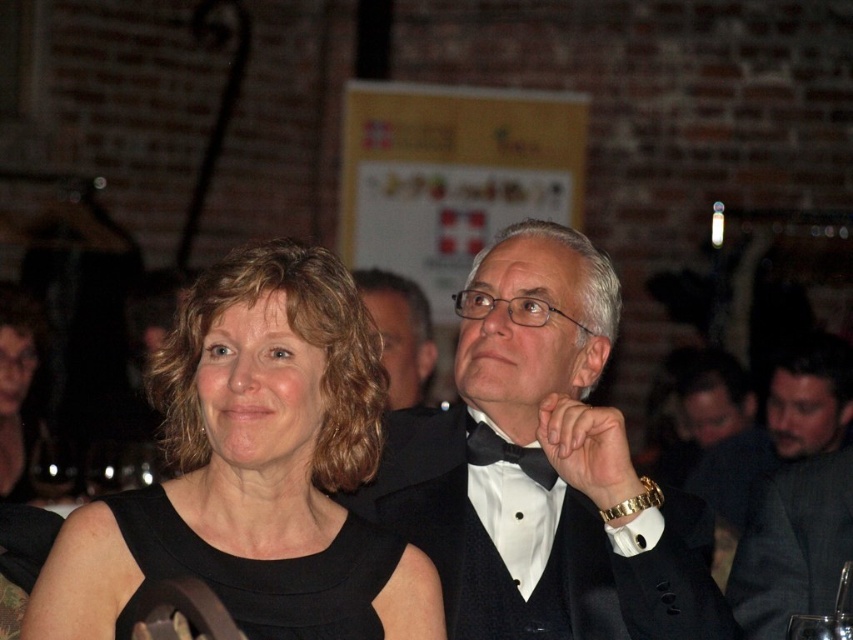
You are a photographer at a formal event. You need to position a spotlight on the black satin tuxedo at center and the dark gray suit at right. Since the spotlight can only illuminate one person at a time, which one should you aim it at first if you want to follow the spatial arrangement from left to right?

The black satin tuxedo at center is to the left of the dark gray suit at right, so you should aim the spotlight at the black satin tuxedo at center first when moving from left to right.

You are at a formal dinner and need to pass a napkin to the person represented by the point at coordinates point (756, 499) and point (431, 332). Which point is closer to you if you are standing in the center of the room?

Point (756, 499) is in front of point (431, 332), so if you are standing in the center of the room, the point (756, 499) is closer to you.